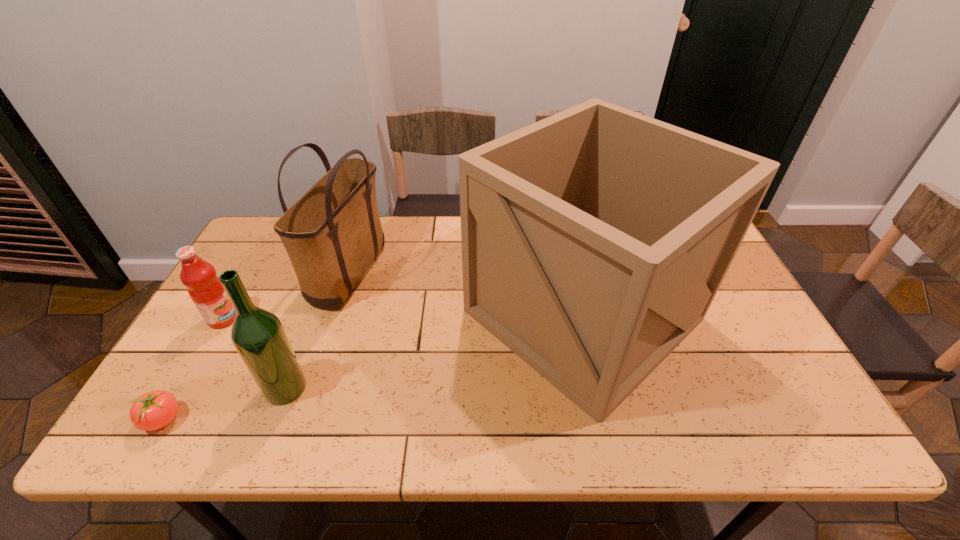
Locate an element on the screen. the tallest object is located at coordinates click(x=594, y=241).

Locate an element on the screen. The image size is (960, 540). the rightmost object is located at coordinates (594, 241).

What are the coordinates of `tote bag` in the screenshot? It's located at (332, 234).

I want to click on alcohol, so click(x=257, y=334).

This screenshot has width=960, height=540. What are the coordinates of `the fourth tallest object` in the screenshot? It's located at (204, 287).

Identify the location of the shortest object. (156, 409).

Where is `vacant space located 0.320m on the left of the tallest object`? vacant space located 0.320m on the left of the tallest object is located at coordinates (348, 314).

Where is `vacant area situated 0.210m on the front of the tote bag`? vacant area situated 0.210m on the front of the tote bag is located at coordinates (315, 381).

I want to click on vacant area situated 0.240m on the left of the alcohol, so click(164, 388).

At what (x,y) coordinates should I click in order to perform the action: click on free location located 0.340m on the front label of the second shortest object. Please return your answer as a coordinate pair (x, y). The image size is (960, 540). Looking at the image, I should click on (363, 319).